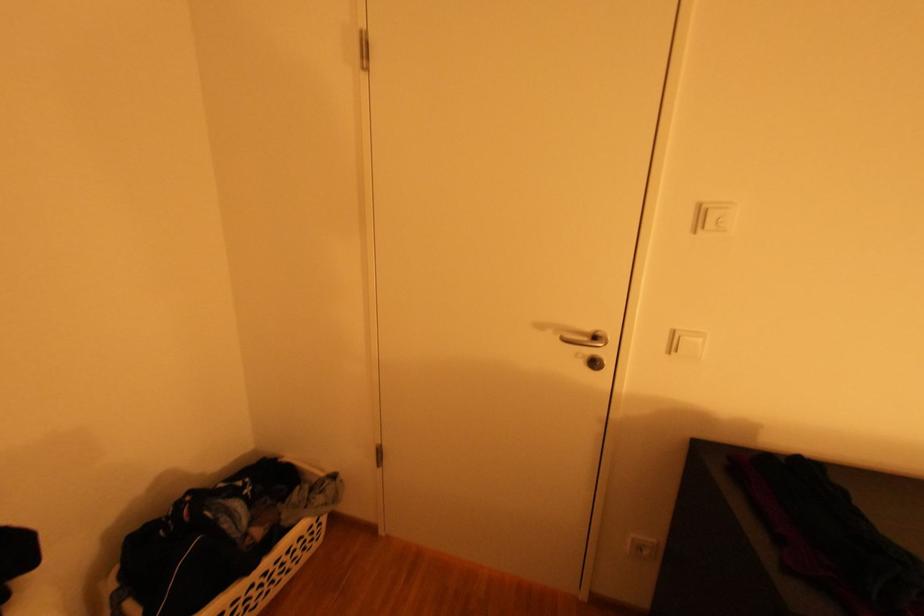
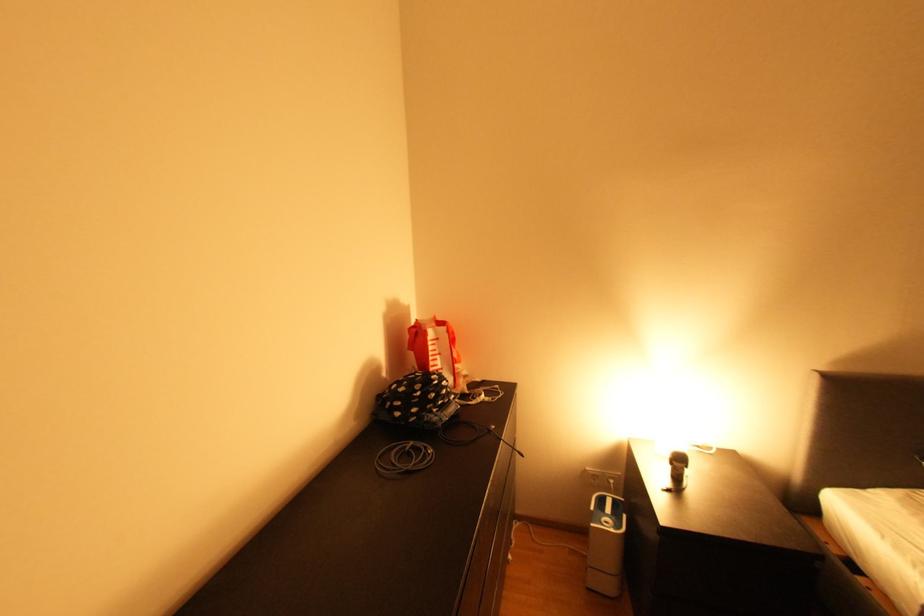
Question: Based on the continuous images, in which direction is the camera rotating? Reply with the corresponding letter.

Choices:
 (A) Left
 (B) Right
 (C) Up
 (D) Down

Answer: (B)